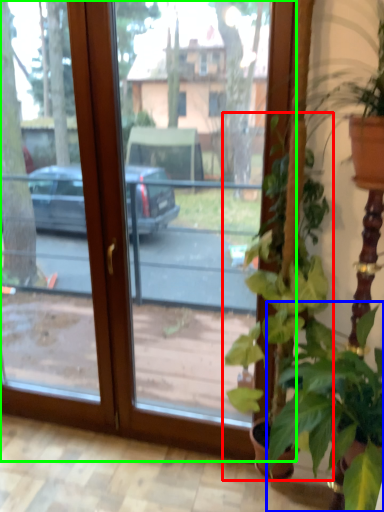
Question: Estimate the real-world distances between objects in this image. Which object is farther from houseplant (highlighted by a red box), houseplant (highlighted by a blue box) or window (highlighted by a green box)?

Choices:
 (A) houseplant
 (B) window

Answer: (B)